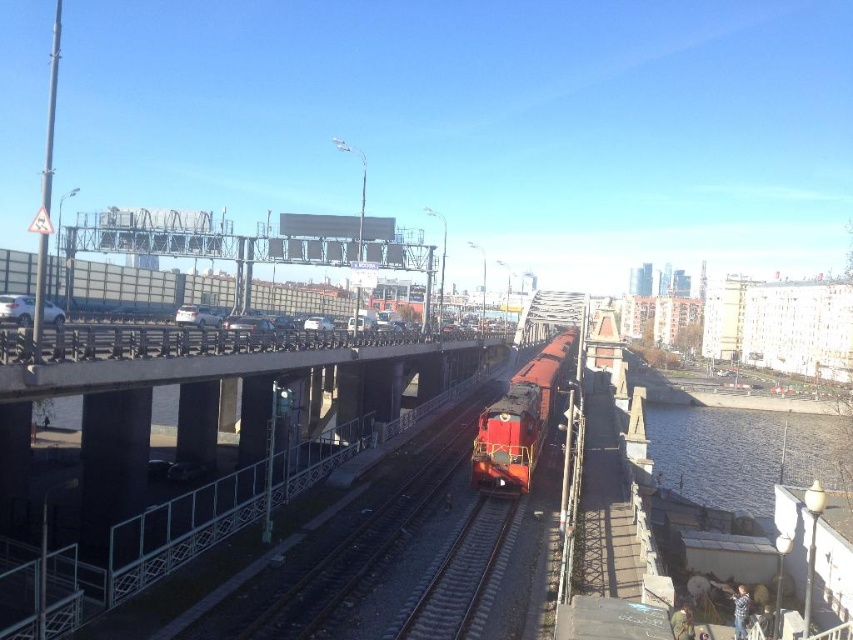
Question: Which point is closer to the camera taking this photo?

Choices:
 (A) (498, 401)
 (B) (752, 484)
 (C) (105, 240)

Answer: (A)

Question: Observing the image, what is the correct spatial positioning of metallic gray billboard at upper center in reference to smooth steel tracks at center?

Choices:
 (A) left
 (B) right

Answer: (A)

Question: Is metallic gray billboard at upper center closer to camera compared to matte red train at center?

Choices:
 (A) yes
 (B) no

Answer: (B)

Question: Estimate the real-world distances between objects in this image. Which object is closer to the clear water at lower right?

Choices:
 (A) matte red train at center
 (B) smooth steel tracks at center
 (C) metallic gray billboard at upper center

Answer: (A)

Question: Which of these objects is positioned farthest from the metallic gray billboard at upper center?

Choices:
 (A) smooth steel tracks at center
 (B) matte red train at center

Answer: (A)

Question: Can you confirm if clear water at lower right is bigger than metallic gray billboard at upper center?

Choices:
 (A) yes
 (B) no

Answer: (A)